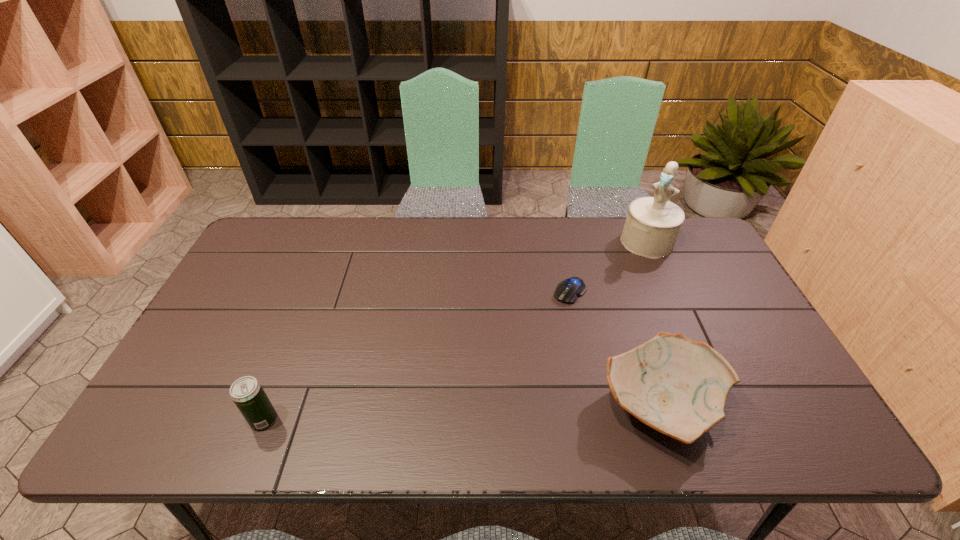
Identify the location of free space located at the beak of the figurine. Image resolution: width=960 pixels, height=540 pixels. (594, 309).

The image size is (960, 540). Find the location of `vacant area situated on the button side of the shortest object`. vacant area situated on the button side of the shortest object is located at coordinates (535, 328).

In order to click on vacant region located on the button side of the shortest object in this screenshot , I will do `click(551, 312)`.

Find the location of `free location located 0.360m on the button side of the shortest object`. free location located 0.360m on the button side of the shortest object is located at coordinates (482, 383).

Identify the location of object situated at the far edge. (652, 226).

Locate an element on the screen. beer can that is at the near edge is located at coordinates (246, 392).

I want to click on pottery at the near edge, so click(x=677, y=386).

Where is `object present at the right edge`? This screenshot has width=960, height=540. object present at the right edge is located at coordinates (652, 226).

Find the location of a particular element. The width and height of the screenshot is (960, 540). object located at the far right corner is located at coordinates (x=652, y=226).

You are a GUI agent. You are given a task and a screenshot of the screen. Output one action in this format:
    pyautogui.click(x=<x>, y=<y>)
    Task: Click on the vacant space at the far edge of the desktop
    The image size is (960, 540).
    Given the screenshot: What is the action you would take?
    pyautogui.click(x=490, y=253)